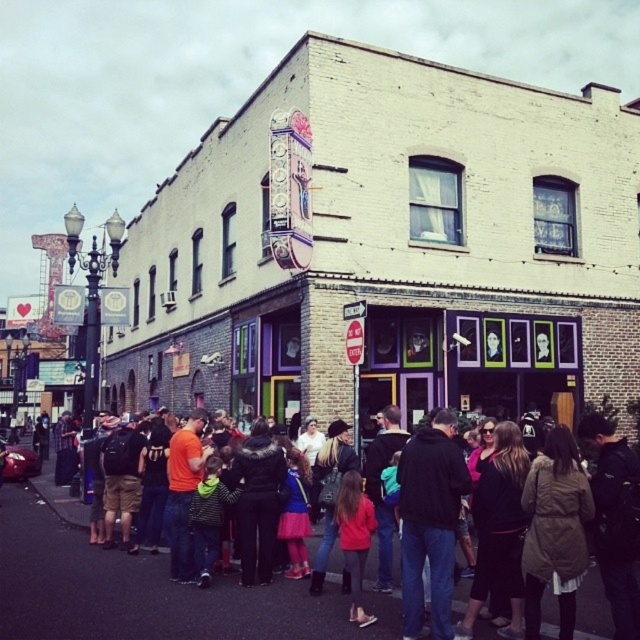
You are a photographer trying to capture a candid shot of the dark brown leather jacket at center and the dark blue jeans at center in the lively street scene. Since you want to focus on the jacket, which object should you adjust your camera settings to prioritize in terms of size in the frame?

The dark brown leather jacket at center is larger in size than the dark blue jeans at center, so you should prioritize focusing on the dark brown leather jacket at center as it naturally takes up more space in the frame.

You are standing at the corner of the street and want to locate the dark brown leather jacket at center. According to the coordinates provided, in which direction should you look relative to your current position?

The dark brown leather jacket at center is located at coordinates point (182, 602). Since the x coordinate is 0.941, which is closer to the right edge of the image, and the y coordinate is 0.287, closer to the bottom edge, you should look towards the bottom right direction from your current position.